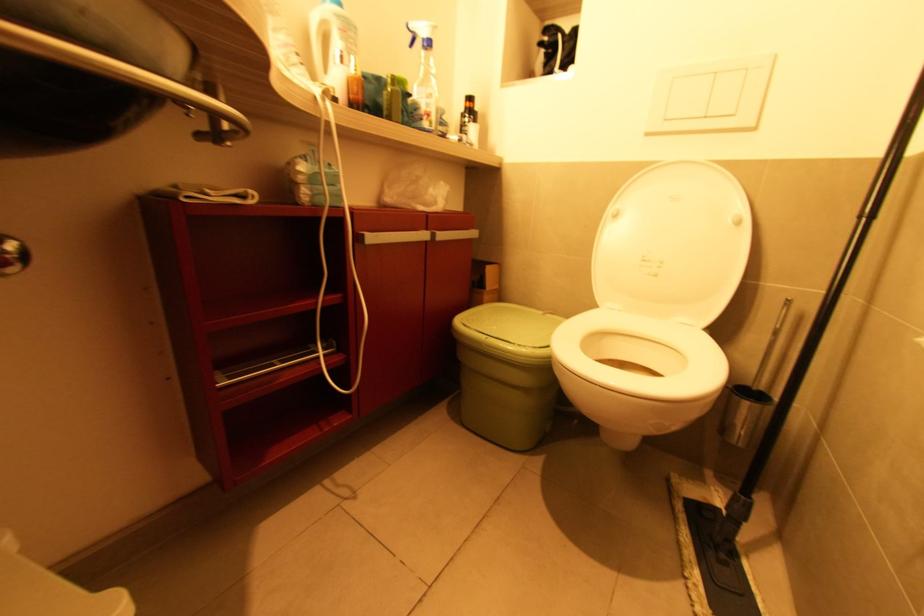
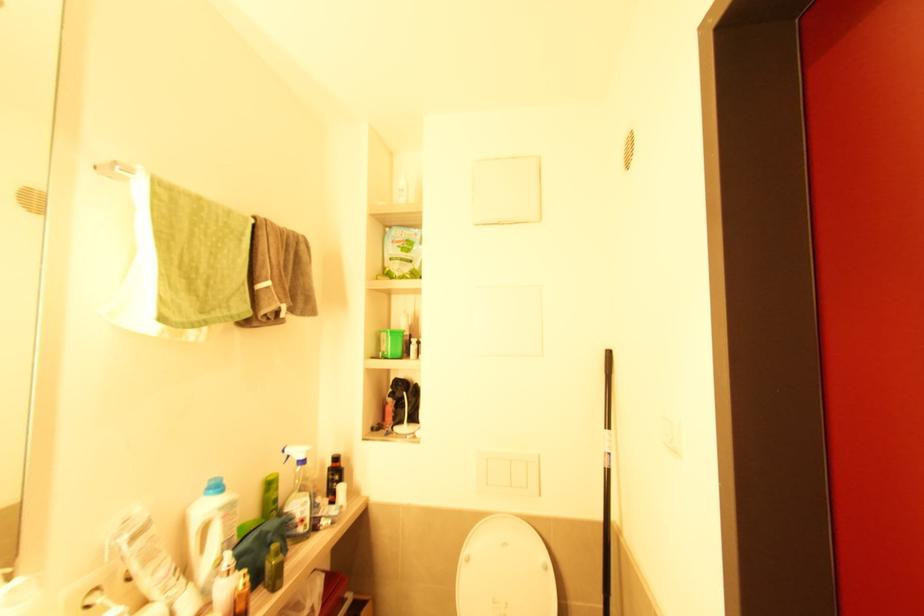
The point at (342, 31) is marked in the first image. Where is the corresponding point in the second image?

(224, 519)